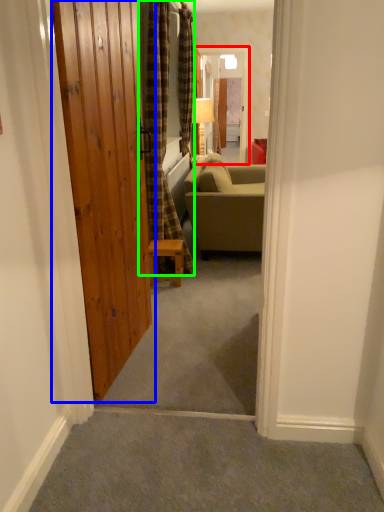
Question: Estimate the real-world distances between objects in this image. Which object is farther from screen door (highlighted by a red box), door (highlighted by a blue box) or curtain (highlighted by a green box)?

Choices:
 (A) door
 (B) curtain

Answer: (A)